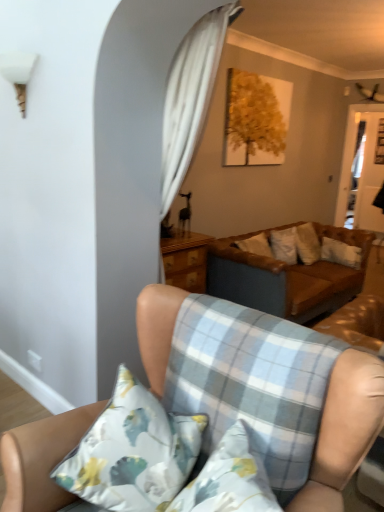
Question: Relative to light brown leather couch at center, which is the 1th studio couch in front-to-back order, is white sheer curtain at upper center in front or behind?

Choices:
 (A) behind
 (B) front

Answer: (A)

Question: In terms of size, does white sheer curtain at upper center appear bigger or smaller than light brown leather couch at center, the second studio couch viewed from the back?

Choices:
 (A) big
 (B) small

Answer: (B)

Question: Which is farther from the white sheer curtain at upper center?

Choices:
 (A) white plastic lampshade at upper left
 (B) light brown leather couch at center, the second studio couch viewed from the back
 (C) brown leather couch at center, the first studio couch positioned from the back
 (D) floral fabric pillow at lower left
 (E) transparent glass door at right

Answer: (E)

Question: Considering the real-world distances, which object is farthest from the light blue plaid cushion at lower center?

Choices:
 (A) white sheer curtain at upper center
 (B) light brown leather couch at center, which is the 1th studio couch in front-to-back order
 (C) transparent glass door at right
 (D) white plastic lampshade at upper left
 (E) brown leather couch at center, which is the 2th studio couch in front-to-back order

Answer: (C)